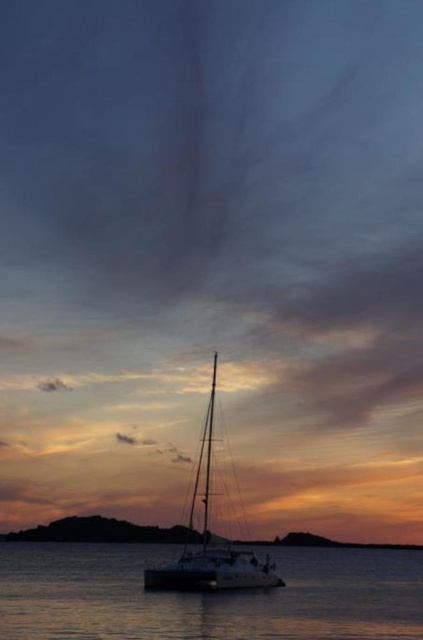
Which is behind, point (222, 556) or point (66, 524)?

Positioned behind is point (66, 524).

Which is above, satin white sailboat at center or smooth sand at lower center?

satin white sailboat at center is higher up.

The image size is (423, 640). Find the location of `satin white sailboat at center`. satin white sailboat at center is located at coordinates (211, 540).

Between point (167, 605) and point (32, 538), which one is positioned behind?

Point (32, 538)

Can you confirm if silvery reflective water at lower center is bigger than smooth sand at lower center?

No, silvery reflective water at lower center is not bigger than smooth sand at lower center.

Describe the element at coordinates (206, 596) in the screenshot. This screenshot has height=640, width=423. I see `silvery reflective water at lower center` at that location.

Where is `silvery reflective water at lower center`? silvery reflective water at lower center is located at coordinates (206, 596).

Who is more distant from viewer, (2,579) or (203,531)?

Point (2,579)

Is silvery reflective water at lower center shorter than satin white sailboat at center?

In fact, silvery reflective water at lower center may be taller than satin white sailboat at center.

Is point (360, 612) behind point (202, 461)?

No, (360, 612) is closer to viewer.

The width and height of the screenshot is (423, 640). Identify the location of silvery reflective water at lower center. point(206,596).